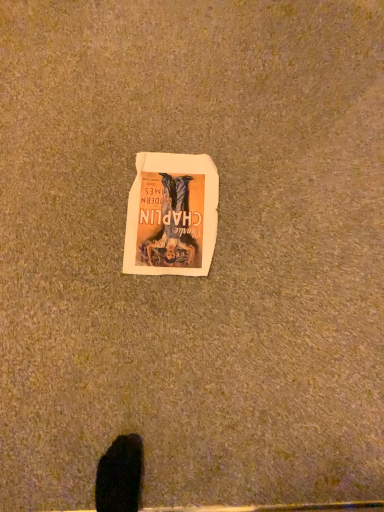
Where is `matte paper poster at center`? This screenshot has height=512, width=384. matte paper poster at center is located at coordinates (172, 215).

This screenshot has height=512, width=384. What do you see at coordinates (172, 215) in the screenshot? I see `matte paper poster at center` at bounding box center [172, 215].

What are the coordinates of `matte paper poster at center` in the screenshot? It's located at (172, 215).